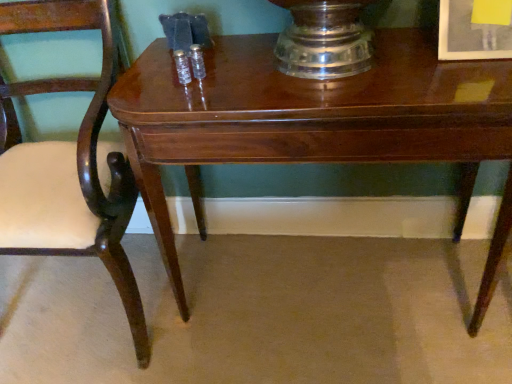
Identify the location of vacant space in between mahogany wood chair at left and glossy wood table at center. This screenshot has width=512, height=384. (256, 347).